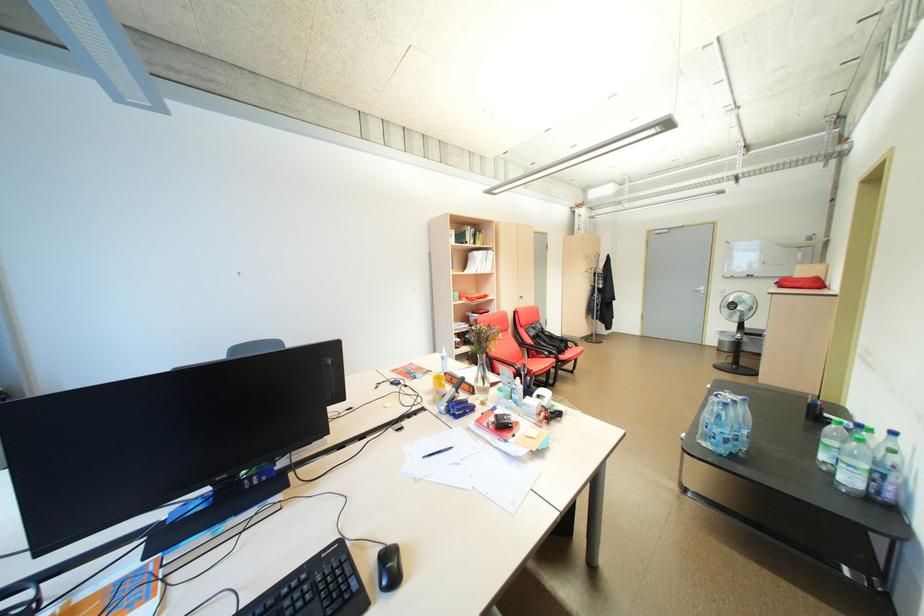
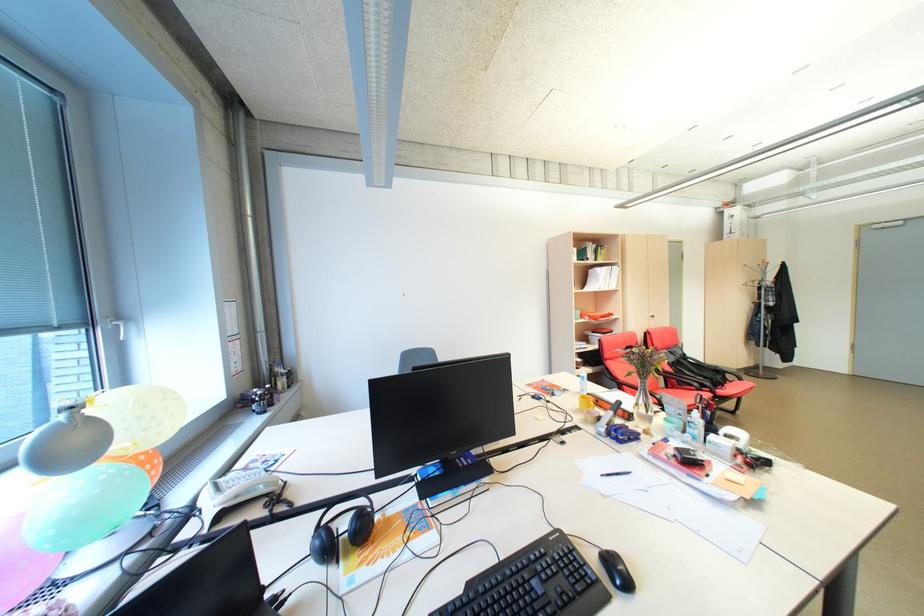
Locate, in the second image, the point that corresponds to the point at 393,583 in the first image.

(627, 582)